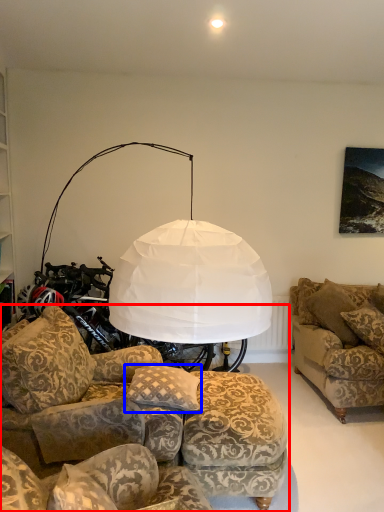
Question: Among these objects, which one is nearest to the camera, studio couch (highlighted by a red box) or pillow (highlighted by a blue box)?

Choices:
 (A) studio couch
 (B) pillow

Answer: (A)